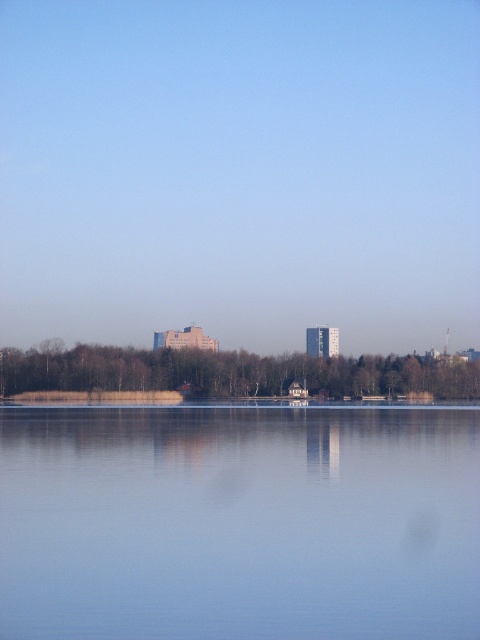
Based on the photo, can you confirm if smooth concrete buildings at center is positioned to the right of transparent glass water at center?

Incorrect, smooth concrete buildings at center is not on the right side of transparent glass water at center.

Is point (194, 202) positioned after point (105, 451)?

Yes, point (194, 202) is behind point (105, 451).

Image resolution: width=480 pixels, height=640 pixels. Describe the element at coordinates (240, 172) in the screenshot. I see `smooth concrete buildings at center` at that location.

Identify the location of smooth concrete buildings at center. The width and height of the screenshot is (480, 640). (240, 172).